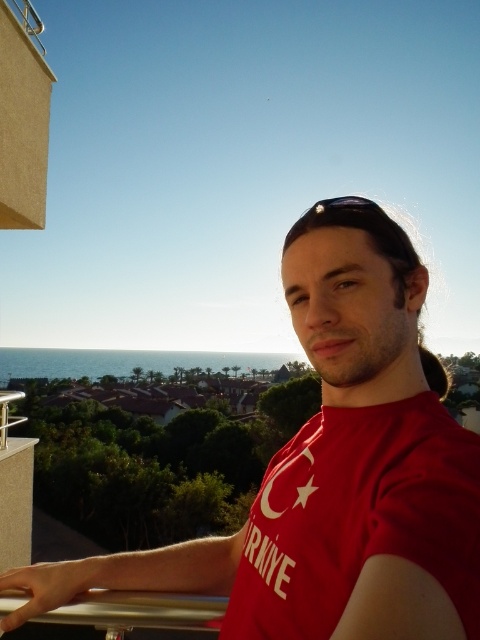
Can you confirm if red matte t-shirt at center is taller than red matte t-shirt at right?

In fact, red matte t-shirt at center may be shorter than red matte t-shirt at right.

Does red matte t-shirt at center appear over red matte t-shirt at right?

Yes, red matte t-shirt at center is above red matte t-shirt at right.

This screenshot has width=480, height=640. Identify the location of red matte t-shirt at center. click(x=334, y=472).